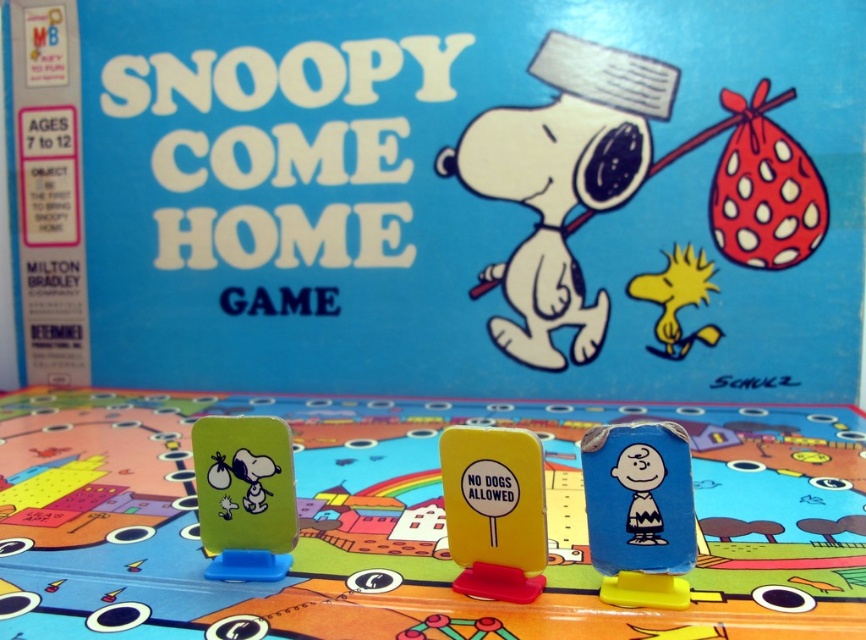
You are playing the game and need to place a token on the exact center of the board. The board has a matte green card at center. Where should you place your token?

You should place your token at the coordinates point (438, 195) where the matte green card at center is located.

You are standing 2 meters away from the board game. If you want to place your hand on the point marked as point (x=520, y=176), will your hand reach it?

The distance of point (x=520, y=176) from viewer is 1.74 meters, so yes, your hand can reach it since you are standing 2 meters away which is farther than the point.